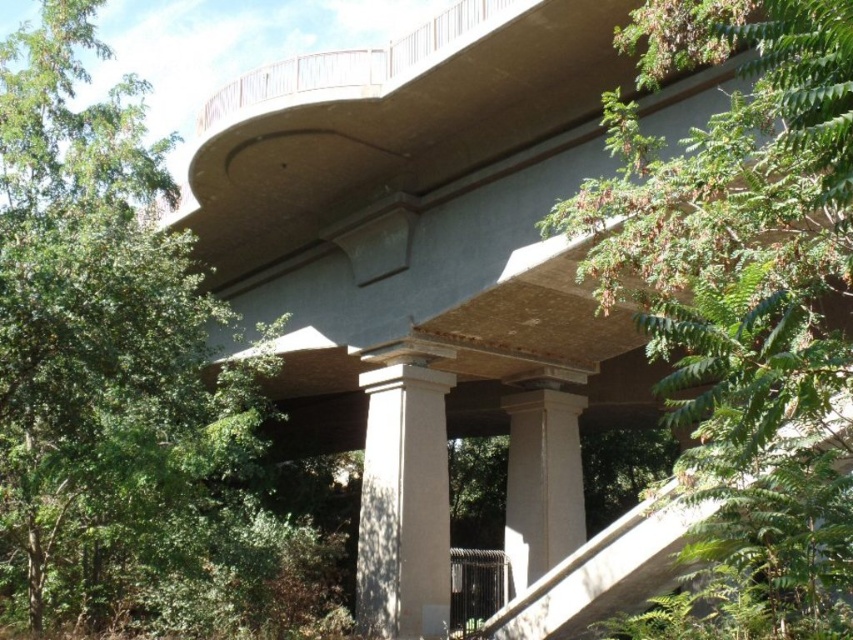
Question: Among these points, which one is nearest to the camera?

Choices:
 (A) (x=395, y=525)
 (B) (x=491, y=369)
 (C) (x=16, y=420)
 (D) (x=840, y=29)

Answer: (D)

Question: Does smooth concrete column at center appear over concrete stairs at center?

Choices:
 (A) yes
 (B) no

Answer: (B)

Question: Can you confirm if green leafy tree at upper left is thinner than concrete stairs at center?

Choices:
 (A) no
 (B) yes

Answer: (A)

Question: Among these objects, which one is farthest from the camera?

Choices:
 (A) green leafy tree at upper right
 (B) smooth concrete column at center
 (C) concrete stairs at center
 (D) green leafy tree at upper left

Answer: (B)

Question: Which of these objects is positioned farthest from the green leafy tree at upper left?

Choices:
 (A) concrete at center
 (B) concrete stairs at center
 (C) green leafy tree at upper right

Answer: (B)

Question: Is green leafy tree at upper left above white smooth column at center?

Choices:
 (A) yes
 (B) no

Answer: (A)